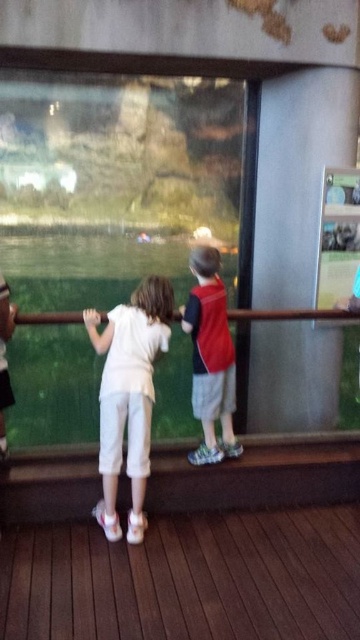
In the scene shown: Between white cotton shirt at center and red fabric backpack at center, which one appears on the right side from the viewer's perspective?

red fabric backpack at center

Can you confirm if white cotton shirt at center is smaller than red fabric backpack at center?

No, white cotton shirt at center is not smaller than red fabric backpack at center.

The height and width of the screenshot is (640, 360). Describe the element at coordinates (128, 396) in the screenshot. I see `white cotton shirt at center` at that location.

This screenshot has height=640, width=360. I want to click on white cotton shirt at center, so click(128, 396).